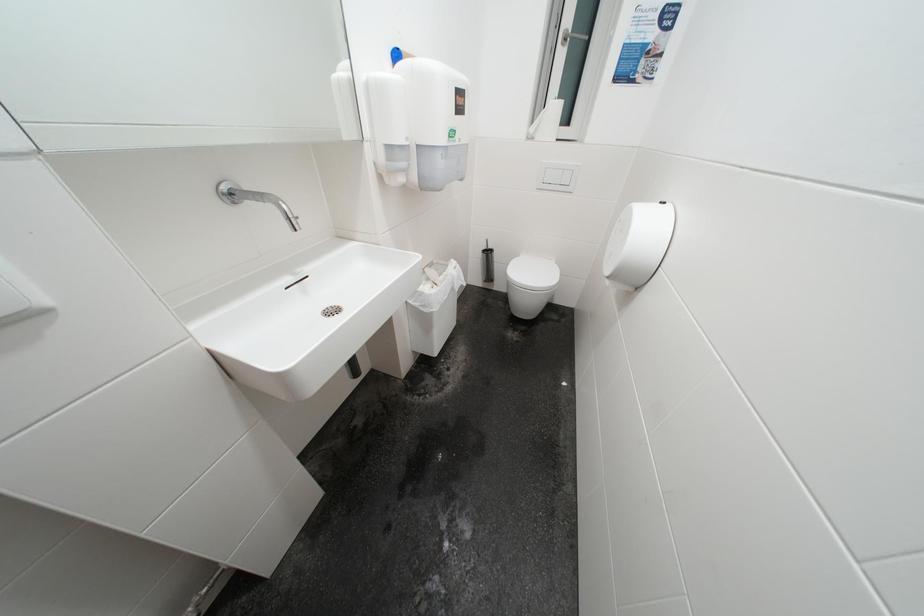
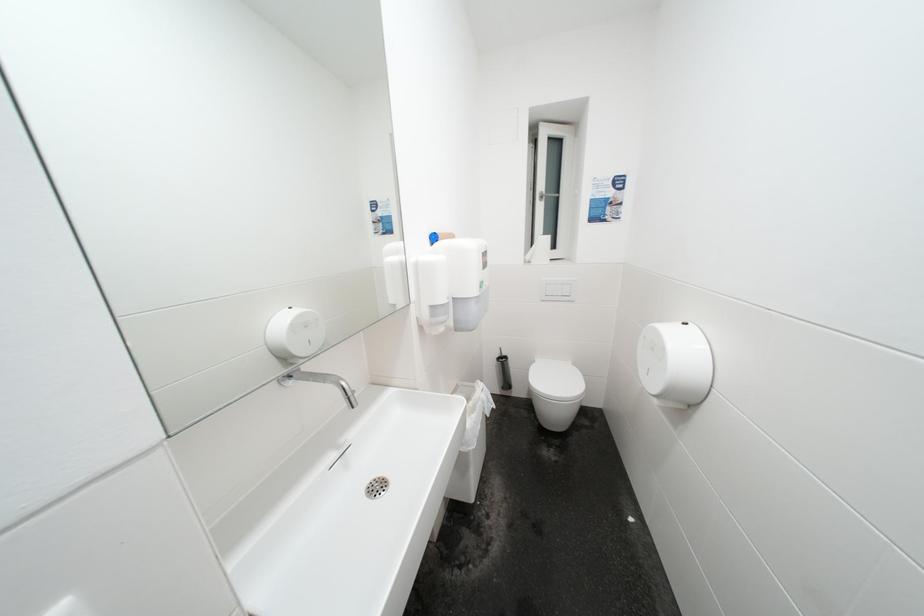
Question: How did the camera likely rotate?

Choices:
 (A) Left
 (B) Right
 (C) Up
 (D) Down

Answer: (C)